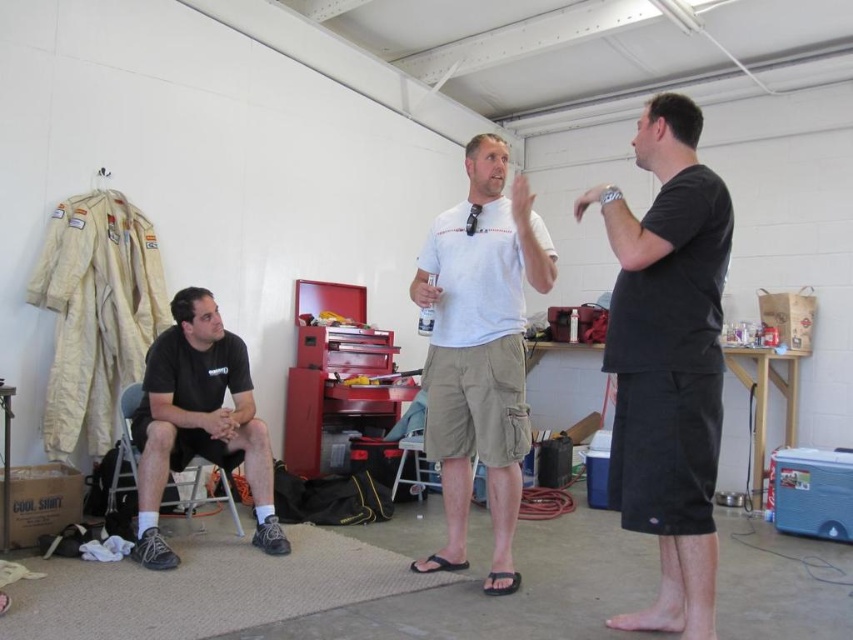
Question: Can you confirm if black cotton t-shirt at right is bigger than white cotton t-shirt at center?

Choices:
 (A) no
 (B) yes

Answer: (A)

Question: Among these objects, which one is nearest to the camera?

Choices:
 (A) white cotton t-shirt at center
 (B) black matte shirt at left
 (C) black cotton t-shirt at right

Answer: (C)

Question: Which is farther from the black cotton t-shirt at right?

Choices:
 (A) white cotton t-shirt at center
 (B) black matte shirt at left

Answer: (B)

Question: Among these points, which one is farthest from the camera?

Choices:
 (A) (496, 406)
 (B) (154, 472)
 (C) (695, 522)

Answer: (B)

Question: Is white cotton t-shirt at center below black matte shirt at left?

Choices:
 (A) no
 (B) yes

Answer: (A)

Question: Is black cotton t-shirt at right below white cotton t-shirt at center?

Choices:
 (A) no
 (B) yes

Answer: (B)